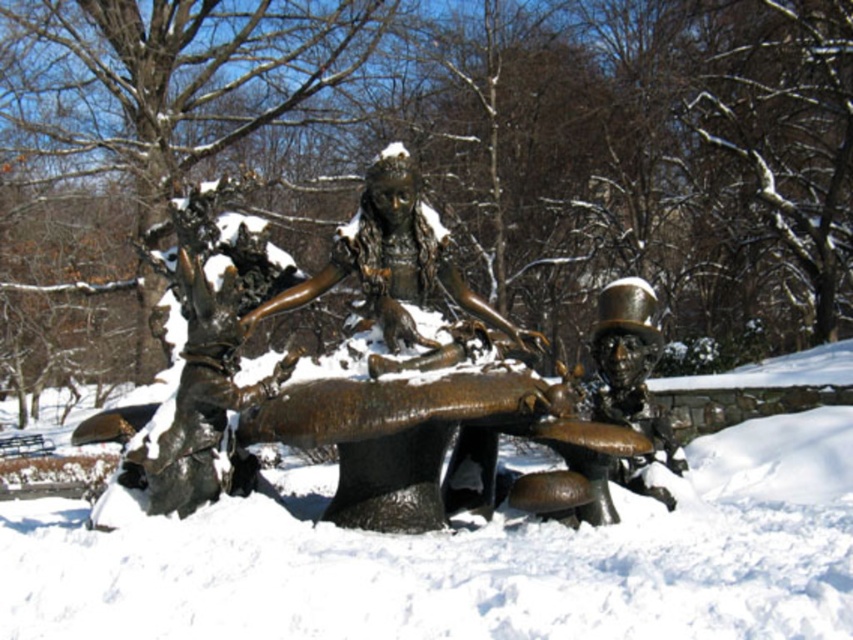
Between slightly frosted bronze table at center and bronze statue at center, which one is positioned lower?

slightly frosted bronze table at center

Is slightly frosted bronze table at center thinner than bronze statue at center?

In fact, slightly frosted bronze table at center might be wider than bronze statue at center.

What are the coordinates of `slightly frosted bronze table at center` in the screenshot? It's located at (466, 561).